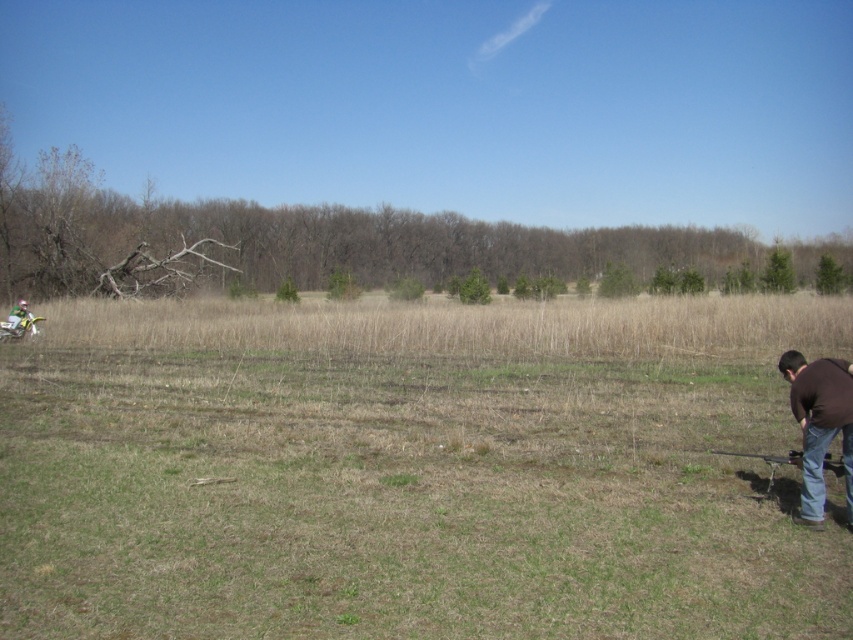
Can you confirm if dry grass at center is taller than green matte helmet at left?

Correct, dry grass at center is much taller as green matte helmet at left.

Who is positioned more to the left, dry grass at center or green matte helmet at left?

Positioned to the left is green matte helmet at left.

Locate an element on the screen. dry grass at center is located at coordinates (412, 472).

Where is `dry grass at center`? The width and height of the screenshot is (853, 640). dry grass at center is located at coordinates (412, 472).

Can you confirm if dry grass at center is wider than brown cotton shirt at lower right?

Yes, dry grass at center is wider than brown cotton shirt at lower right.

The width and height of the screenshot is (853, 640). Find the location of `dry grass at center`. dry grass at center is located at coordinates (412, 472).

Image resolution: width=853 pixels, height=640 pixels. In order to click on dry grass at center in this screenshot , I will do `click(412, 472)`.

Between brown cotton shirt at lower right and green matte helmet at left, which one appears on the right side from the viewer's perspective?

From the viewer's perspective, brown cotton shirt at lower right appears more on the right side.

Describe the element at coordinates (819, 424) in the screenshot. I see `brown cotton shirt at lower right` at that location.

You are a GUI agent. You are given a task and a screenshot of the screen. Output one action in this format:
    pyautogui.click(x=<x>, y=<y>)
    Task: Click on the brown cotton shirt at lower right
    This screenshot has width=853, height=640.
    Given the screenshot: What is the action you would take?
    pyautogui.click(x=819, y=424)

Locate an element on the screen. The width and height of the screenshot is (853, 640). brown cotton shirt at lower right is located at coordinates (819, 424).